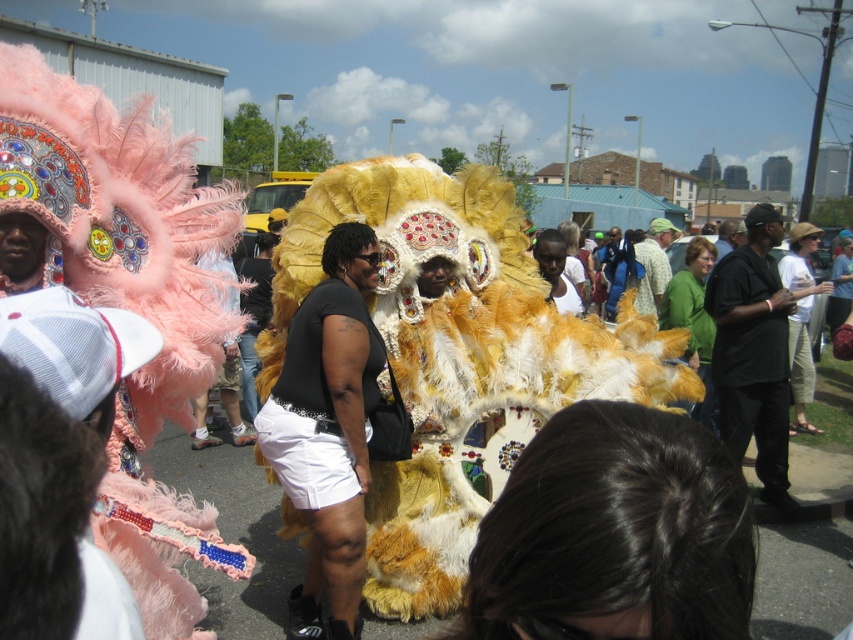
Is point (718, 323) more distant than point (788, 250)?

No, it is not.

The image size is (853, 640). I want to click on black cotton shirt at center, so click(x=753, y=353).

In order to click on black cotton shirt at center in this screenshot , I will do `click(753, 353)`.

Is feathered pink costume at left bigger than white matte shirt at center?

Yes.

This screenshot has width=853, height=640. What do you see at coordinates (125, 298) in the screenshot? I see `feathered pink costume at left` at bounding box center [125, 298].

Find the location of a particular element. The image size is (853, 640). feathered pink costume at left is located at coordinates (125, 298).

Looking at this image, can you confirm if fuzzy yellow costume at center is shorter than feathered pink costume at left?

In fact, fuzzy yellow costume at center may be taller than feathered pink costume at left.

Between fuzzy yellow costume at center and feathered pink costume at left, which one has less height?

feathered pink costume at left is shorter.

Between point (457, 396) and point (24, 106), which one is positioned behind?

The point (457, 396) is more distant.

I want to click on fuzzy yellow costume at center, so click(x=457, y=356).